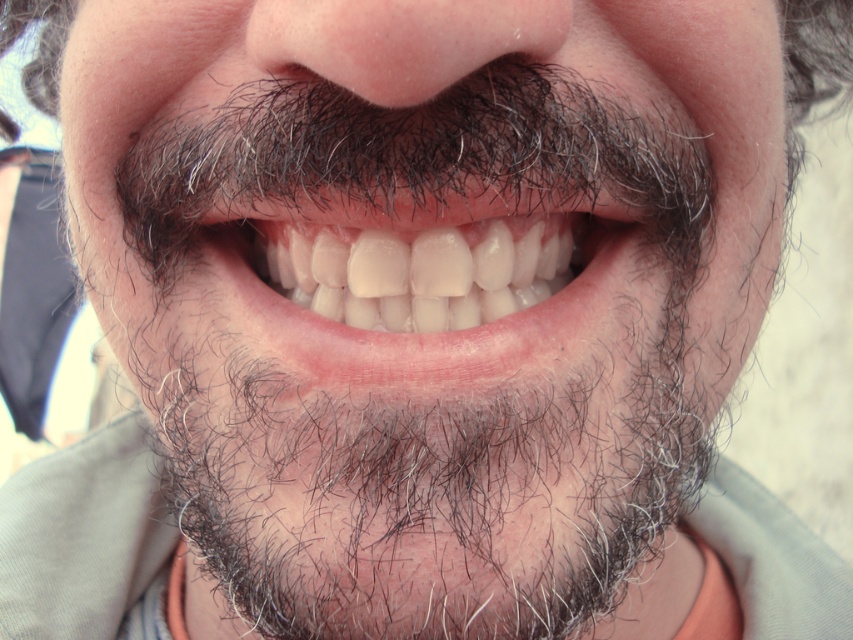
You are holding a small drone that is 12 inches in length. You want to fly it from your current position to the point marked at coordinates point (341, 305) in the image. Can the drone fit through the space between your current position and that point without hitting anything?

The distance between your current position and point (341, 305) is 15.31 inches. Since the drone is 12 inches long, it can fit through the space as there is enough clearance.